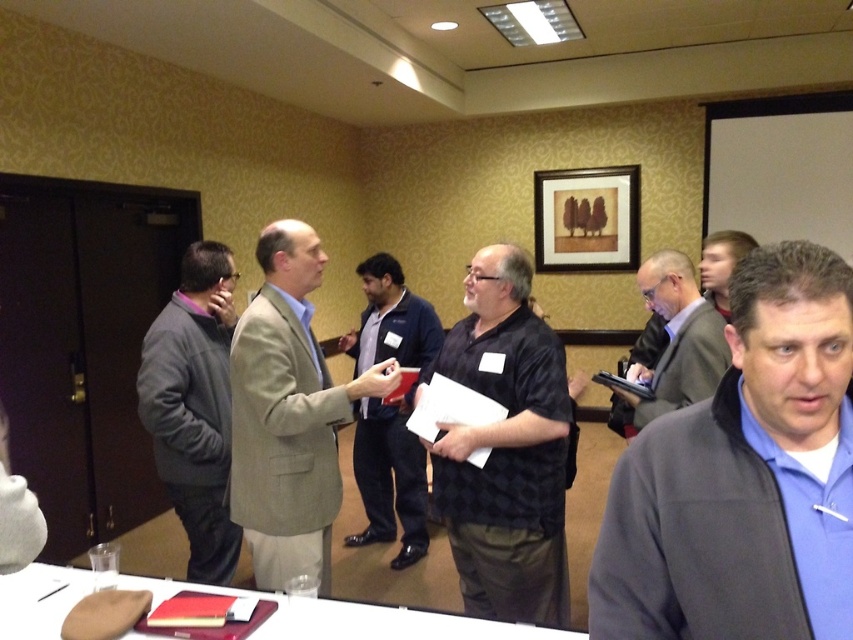
What do you see at coordinates (744, 476) in the screenshot?
I see `blue fleece jacket at center` at bounding box center [744, 476].

Is blue fleece jacket at center further to camera compared to wooden picture frame at upper center?

No, it is in front of wooden picture frame at upper center.

This screenshot has height=640, width=853. In order to click on blue fleece jacket at center in this screenshot , I will do `click(744, 476)`.

Between dark blue shirt at center and matte black shirt at center, which one appears on the left side from the viewer's perspective?

Positioned to the left is dark blue shirt at center.

Does dark blue shirt at center have a greater width compared to matte black shirt at center?

Indeed, dark blue shirt at center has a greater width compared to matte black shirt at center.

Image resolution: width=853 pixels, height=640 pixels. Identify the location of dark blue shirt at center. (390, 477).

This screenshot has height=640, width=853. I want to click on dark blue shirt at center, so click(x=390, y=477).

Does black checkered shirt at center appear on the left side of smooth wood table at lower left?

In fact, black checkered shirt at center is to the right of smooth wood table at lower left.

Is black checkered shirt at center further to camera compared to smooth wood table at lower left?

That is True.

Is point (511, 568) closer to camera compared to point (25, 609)?

No, it is behind (25, 609).

Locate an element on the screen. The height and width of the screenshot is (640, 853). black checkered shirt at center is located at coordinates (505, 449).